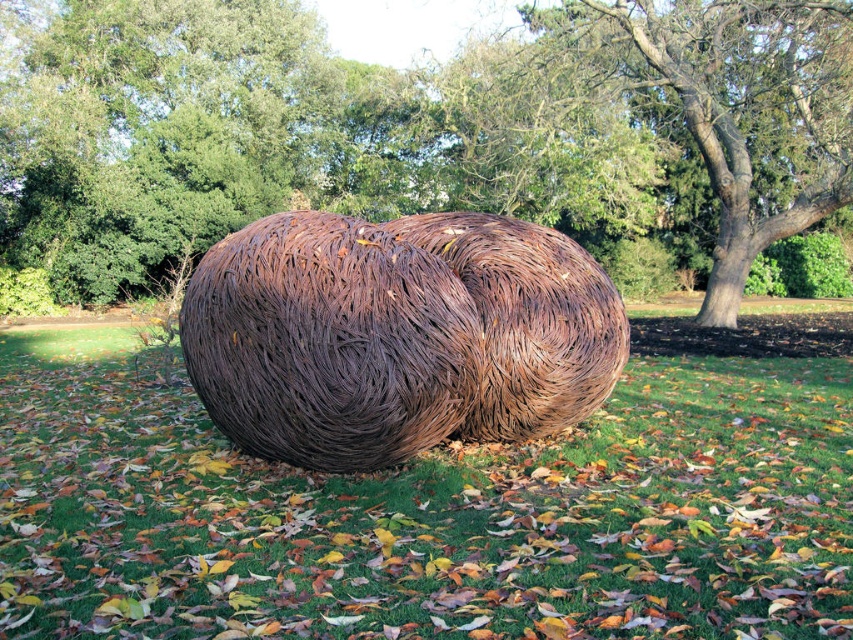
Looking at this image, does green grass at center have a smaller size compared to brown textured tree at center?

Yes, green grass at center is smaller than brown textured tree at center.

Which is in front, point (733, 442) or point (776, 109)?

Point (733, 442) is more forward.

Locate an element on the screen. The image size is (853, 640). green grass at center is located at coordinates (425, 513).

Consider the image. Does rusty wire sculpture at center appear on the right side of brown textured tree at center?

In fact, rusty wire sculpture at center is to the left of brown textured tree at center.

Which is in front, point (445, 435) or point (727, 16)?

Positioned in front is point (445, 435).

Where is `rusty wire sculpture at center`? The height and width of the screenshot is (640, 853). rusty wire sculpture at center is located at coordinates (397, 333).

Does point (634, 269) lie behind point (413, 362)?

Yes, point (634, 269) is behind point (413, 362).

Is point (160, 189) closer to viewer compared to point (509, 336)?

No, it is behind (509, 336).

Identify the location of brown textured sculpture at center. This screenshot has height=640, width=853. click(422, 132).